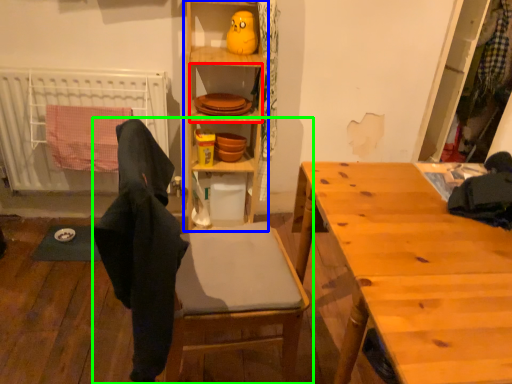
Question: Which object is positioned farthest from shelf (highlighted by a red box)? Select from cabinetry (highlighted by a blue box) and chair (highlighted by a green box).

Choices:
 (A) cabinetry
 (B) chair

Answer: (B)